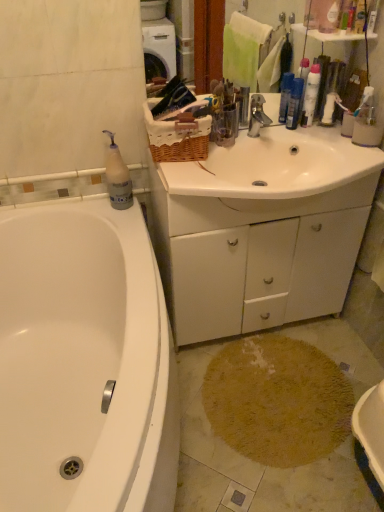
Where is `metallic silver faucet at center`? This screenshot has height=512, width=384. metallic silver faucet at center is located at coordinates (257, 115).

What do you see at coordinates (84, 361) in the screenshot? I see `white glossy bathtub at lower left` at bounding box center [84, 361].

Where is `white matte cabinet at center`? white matte cabinet at center is located at coordinates (261, 227).

The width and height of the screenshot is (384, 512). What are the coordinates of `blue plastic bottles at upper right, placed as the 1th toiletry when sorted from bottom to top` in the screenshot? It's located at (285, 95).

This screenshot has height=512, width=384. I want to click on metallic silver faucet at center, so click(x=257, y=115).

Is blue plastic bottles at upper right, the 2th toiletry when ordered from front to back, positioned far away from translucent plastic bottle at upper left, the first cleaning product from the left?

No, there isn't a large distance between blue plastic bottles at upper right, the 2th toiletry when ordered from front to back, and translucent plastic bottle at upper left, the first cleaning product from the left.

Can you tell me how much blue plastic bottles at upper right, the first toiletry from the back, and translucent plastic bottle at upper left, marked as the 2th cleaning product in a right-to-left arrangement, differ in facing direction?

The angle between the facing direction of blue plastic bottles at upper right, the first toiletry from the back, and the facing direction of translucent plastic bottle at upper left, marked as the 2th cleaning product in a right-to-left arrangement, is 40.1 degrees.

From the image's perspective, is blue plastic bottles at upper right, the second toiletry in the right-to-left sequence, located above or below translucent plastic bottle at upper left, marked as the 2th cleaning product in a right-to-left arrangement?

From the image's perspective, blue plastic bottles at upper right, the second toiletry in the right-to-left sequence, appears above translucent plastic bottle at upper left, marked as the 2th cleaning product in a right-to-left arrangement.

In the scene shown: Can you confirm if blue plastic bottles at upper right, placed as the 1th toiletry when sorted from bottom to top, is bigger than translucent plastic bottle at upper left, the first cleaning product from the left?

No, blue plastic bottles at upper right, placed as the 1th toiletry when sorted from bottom to top, is not bigger than translucent plastic bottle at upper left, the first cleaning product from the left.

Considering the relative positions of white glossy bathtub at lower left and pink plastic bottle at upper right, the 1th toiletry in the right-to-left sequence, in the image provided, is white glossy bathtub at lower left to the left or to the right of pink plastic bottle at upper right, the 1th toiletry in the right-to-left sequence,?

Based on their positions, white glossy bathtub at lower left is located to the left of pink plastic bottle at upper right, the 1th toiletry in the right-to-left sequence.

From a real-world perspective, between white glossy bathtub at lower left and pink plastic bottle at upper right, the 1th toiletry in the right-to-left sequence, who is vertically higher?

pink plastic bottle at upper right, the 1th toiletry in the right-to-left sequence, from a real-world perspective.

Which object is closer to the camera, white glossy bathtub at lower left or pink plastic bottle at upper right, the 1th toiletry when ordered from top to bottom?

Positioned in front is white glossy bathtub at lower left.

Is white glossy bathtub at lower left wider than pink plastic bottle at upper right, the 1th toiletry in the right-to-left sequence?

Correct, the width of white glossy bathtub at lower left exceeds that of pink plastic bottle at upper right, the 1th toiletry in the right-to-left sequence.

Considering the relative positions of blue plastic bottles at upper right, the 2th toiletry from the top, and white glossy sink at center in the image provided, is blue plastic bottles at upper right, the 2th toiletry from the top, to the right of white glossy sink at center from the viewer's perspective?

Yes.

From a real-world perspective, is blue plastic bottles at upper right, placed as the 1th toiletry when sorted from bottom to top, on white glossy sink at center?

Correct, in the physical world, blue plastic bottles at upper right, placed as the 1th toiletry when sorted from bottom to top, is higher than white glossy sink at center.

Is blue plastic bottles at upper right, the 2th toiletry when ordered from front to back, aimed at white glossy sink at center?

Yes, blue plastic bottles at upper right, the 2th toiletry when ordered from front to back, is oriented towards white glossy sink at center.

Is blue plastic bottles at upper right, the 2th toiletry when ordered from front to back, behind white glossy sink at center?

Yes, blue plastic bottles at upper right, the 2th toiletry when ordered from front to back, is further from the camera.

Can you confirm if translucent plastic bottle at upper left, marked as the 2th cleaning product in a right-to-left arrangement, is shorter than beige shaggy rug at lower center?

No.

Is translucent plastic bottle at upper left, arranged as the second cleaning product when viewed from the top, located outside beige shaggy rug at lower center?

translucent plastic bottle at upper left, arranged as the second cleaning product when viewed from the top, lies outside beige shaggy rug at lower center's area.

Is translucent plastic bottle at upper left, arranged as the 1th cleaning product when ordered from the bottom, aimed at beige shaggy rug at lower center?

No, translucent plastic bottle at upper left, arranged as the 1th cleaning product when ordered from the bottom, does not turn towards beige shaggy rug at lower center.

From a real-world perspective, between beige shaggy rug at lower center and translucent plastic bottle at upper left, arranged as the second cleaning product when viewed from the top, who is vertically lower?

beige shaggy rug at lower center is physically lower.

Considering the relative sizes of beige shaggy rug at lower center and translucent plastic bottle at upper left, arranged as the 1th cleaning product when ordered from the bottom, in the image provided, is beige shaggy rug at lower center thinner than translucent plastic bottle at upper left, arranged as the 1th cleaning product when ordered from the bottom,?

No, beige shaggy rug at lower center is not thinner than translucent plastic bottle at upper left, arranged as the 1th cleaning product when ordered from the bottom.

From the image's perspective, is beige shaggy rug at lower center above translucent plastic bottle at upper left, marked as the 2th cleaning product in a right-to-left arrangement?

No, from the image's perspective, beige shaggy rug at lower center is not above translucent plastic bottle at upper left, marked as the 2th cleaning product in a right-to-left arrangement.

Does blue plastic spray bottle at upper right, which is the second cleaning product in left-to-right order, turn towards white glossy bathtub at lower left?

No, blue plastic spray bottle at upper right, which is the second cleaning product in left-to-right order, does not turn towards white glossy bathtub at lower left.

Between blue plastic spray bottle at upper right, which is the first cleaning product from top to bottom, and white glossy bathtub at lower left, which one is positioned in front?

white glossy bathtub at lower left is more forward.

Considering the relative positions of blue plastic spray bottle at upper right, acting as the 2th cleaning product starting from the bottom, and white glossy bathtub at lower left in the image provided, is blue plastic spray bottle at upper right, acting as the 2th cleaning product starting from the bottom, to the left of white glossy bathtub at lower left from the viewer's perspective?

Incorrect, blue plastic spray bottle at upper right, acting as the 2th cleaning product starting from the bottom, is not on the left side of white glossy bathtub at lower left.

Where is `the 2nd cleaning product counting from the right side of the white glossy bathtub at lower left`? Image resolution: width=384 pixels, height=512 pixels. the 2nd cleaning product counting from the right side of the white glossy bathtub at lower left is located at coordinates (311, 95).

Which object is thinner, blue plastic spray bottle at upper right, acting as the 2th cleaning product starting from the bottom, or translucent plastic bottle at upper left, marked as the 2th cleaning product in a right-to-left arrangement?

Thinner between the two is blue plastic spray bottle at upper right, acting as the 2th cleaning product starting from the bottom.

What's the angular difference between blue plastic spray bottle at upper right, acting as the 2th cleaning product starting from the bottom, and translucent plastic bottle at upper left, arranged as the 1th cleaning product when ordered from the bottom,'s facing directions?

The angle between the facing direction of blue plastic spray bottle at upper right, acting as the 2th cleaning product starting from the bottom, and the facing direction of translucent plastic bottle at upper left, arranged as the 1th cleaning product when ordered from the bottom, is 40.1 degrees.

From the image's perspective, which is above, blue plastic spray bottle at upper right, acting as the 2th cleaning product starting from the bottom, or translucent plastic bottle at upper left, the first cleaning product from the left?

blue plastic spray bottle at upper right, acting as the 2th cleaning product starting from the bottom, from the image's perspective.

Would you consider blue plastic spray bottle at upper right, which is the second cleaning product in left-to-right order, to be distant from translucent plastic bottle at upper left, arranged as the 1th cleaning product when ordered from the bottom?

No, blue plastic spray bottle at upper right, which is the second cleaning product in left-to-right order, is in close proximity to translucent plastic bottle at upper left, arranged as the 1th cleaning product when ordered from the bottom.

From the image's perspective, count 1st toiletrys upward from the translucent plastic bottle at upper left, arranged as the 1th cleaning product when ordered from the bottom, and point to it. Please provide its 2D coordinates.

[(285, 95)]

Image resolution: width=384 pixels, height=512 pixels. In the image, there is a pink plastic bottle at upper right, the first toiletry viewed from the front. What are the coordinates of `bathtub below it (from a real-world perspective)` in the screenshot? It's located at (84, 361).

Estimate the real-world distances between objects in this image. Which object is closer to white matte cabinet at center, blue plastic bottles at upper right, the 2th toiletry from the top, or white glossy sink at center?

white glossy sink at center.

Based on their spatial positions, is white matte cabinet at center or pink plastic bottle at upper right, the 1th toiletry when ordered from top to bottom, further from white glossy bathtub at lower left?

The object further to white glossy bathtub at lower left is pink plastic bottle at upper right, the 1th toiletry when ordered from top to bottom.

Based on the photo, from the image, which object appears to be farther from blue plastic spray bottle at upper right, placed as the 1th cleaning product when sorted from right to left, white matte cabinet at center or white glossy bathtub at lower left?

The object further to blue plastic spray bottle at upper right, placed as the 1th cleaning product when sorted from right to left, is white glossy bathtub at lower left.

Which object lies nearer to the anchor point white glossy bathtub at lower left, translucent plastic bottle at upper left, the first cleaning product from the left, or pink plastic bottle at upper right, the 2th toiletry from the left?

The object closer to white glossy bathtub at lower left is translucent plastic bottle at upper left, the first cleaning product from the left.

From the image, which object appears to be farther from blue plastic bottles at upper right, the 2th toiletry from the top, pink plastic bottle at upper right, the 2th toiletry from the left, or metallic silver faucet at center?

pink plastic bottle at upper right, the 2th toiletry from the left, is positioned further to the anchor blue plastic bottles at upper right, the 2th toiletry from the top.

From the image, which object appears to be farther from pink plastic bottle at upper right, the 1th toiletry when ordered from top to bottom, white glossy bathtub at lower left or blue plastic spray bottle at upper right, which is the first cleaning product from top to bottom?

white glossy bathtub at lower left lies further to pink plastic bottle at upper right, the 1th toiletry when ordered from top to bottom, than the other object.

Considering their positions, is pink plastic bottle at upper right, placed as the second toiletry when sorted from back to front, positioned closer to white glossy bathtub at lower left than white glossy sink at center?

white glossy sink at center is closer to white glossy bathtub at lower left.

Looking at this image, which object lies nearer to the anchor point white matte cabinet at center, metallic silver faucet at center or blue plastic spray bottle at upper right, placed as the 1th cleaning product when sorted from right to left?

metallic silver faucet at center is positioned closer to the anchor white matte cabinet at center.

The image size is (384, 512). I want to click on bathtub between metallic silver faucet at center and beige shaggy rug at lower center from top to bottom, so click(x=84, y=361).

Identify the location of cabinetry between translucent plastic bottle at upper left, arranged as the second cleaning product when viewed from the top, and metallic silver faucet at center. (261, 227).

This screenshot has height=512, width=384. In order to click on sink between metallic silver faucet at center and white matte cabinet at center vertically in this screenshot , I will do `click(275, 167)`.

Locate an element on the screen. toiletry that lies between blue plastic spray bottle at upper right, placed as the 1th cleaning product when sorted from right to left, and beige shaggy rug at lower center from top to bottom is located at coordinates (285, 95).